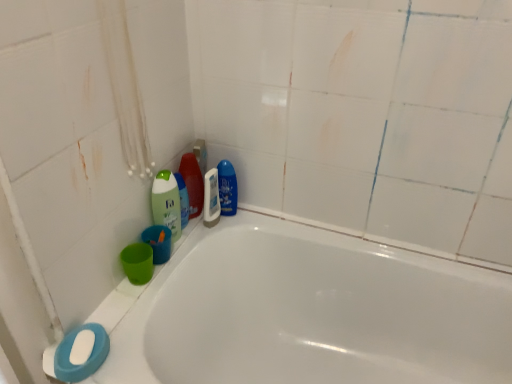
Question: Can you see white glossy mouthwash at center touching green matte bottle at upper left, the 2th cleaning product when ordered from left to right?

Choices:
 (A) no
 (B) yes

Answer: (B)

Question: Does white glossy mouthwash at center have a lesser width compared to green matte bottle at upper left, the 2th cleaning product when ordered from left to right?

Choices:
 (A) no
 (B) yes

Answer: (B)

Question: From a real-world perspective, is white glossy mouthwash at center physically below green matte bottle at upper left, the 2th cleaning product when ordered from left to right?

Choices:
 (A) yes
 (B) no

Answer: (A)

Question: From the image's perspective, does white glossy mouthwash at center appear higher than green matte bottle at upper left, the third cleaning product viewed from the right?

Choices:
 (A) no
 (B) yes

Answer: (A)

Question: Is white glossy mouthwash at center not near green matte bottle at upper left, the 2th cleaning product when ordered from left to right?

Choices:
 (A) yes
 (B) no

Answer: (B)

Question: Considering the relative sizes of white glossy mouthwash at center and green matte bottle at upper left, the 2th cleaning product when ordered from left to right, in the image provided, is white glossy mouthwash at center wider than green matte bottle at upper left, the 2th cleaning product when ordered from left to right,?

Choices:
 (A) no
 (B) yes

Answer: (A)

Question: Is blue glossy bottle at upper center, which appears as the fourth cleaning product when viewed from the left, at the back of green matte bottle at upper left, the third cleaning product viewed from the right?

Choices:
 (A) no
 (B) yes

Answer: (A)

Question: Are green matte bottle at upper left, the 2th cleaning product when ordered from left to right, and blue glossy bottle at upper center, the 1th cleaning product from the right, far apart?

Choices:
 (A) no
 (B) yes

Answer: (A)

Question: Is green matte bottle at upper left, the third cleaning product viewed from the right, thinner than blue glossy bottle at upper center, which appears as the fourth cleaning product when viewed from the left?

Choices:
 (A) no
 (B) yes

Answer: (B)

Question: Can you confirm if green matte bottle at upper left, the third cleaning product viewed from the right, is positioned to the left of blue glossy bottle at upper center, which appears as the fourth cleaning product when viewed from the left?

Choices:
 (A) no
 (B) yes

Answer: (B)

Question: Is blue glossy bottle at upper center, the 1th cleaning product from the right, a part of green matte bottle at upper left, the 2th cleaning product when ordered from left to right?

Choices:
 (A) yes
 (B) no

Answer: (B)

Question: Can you confirm if green matte bottle at upper left, the 2th cleaning product when ordered from left to right, is smaller than blue glossy bottle at upper center, the 1th cleaning product from the right?

Choices:
 (A) yes
 (B) no

Answer: (A)

Question: From the image's perspective, is white glossy bathtub at lower left located beneath green matte bottle at upper left, the third cleaning product viewed from the right?

Choices:
 (A) no
 (B) yes

Answer: (B)